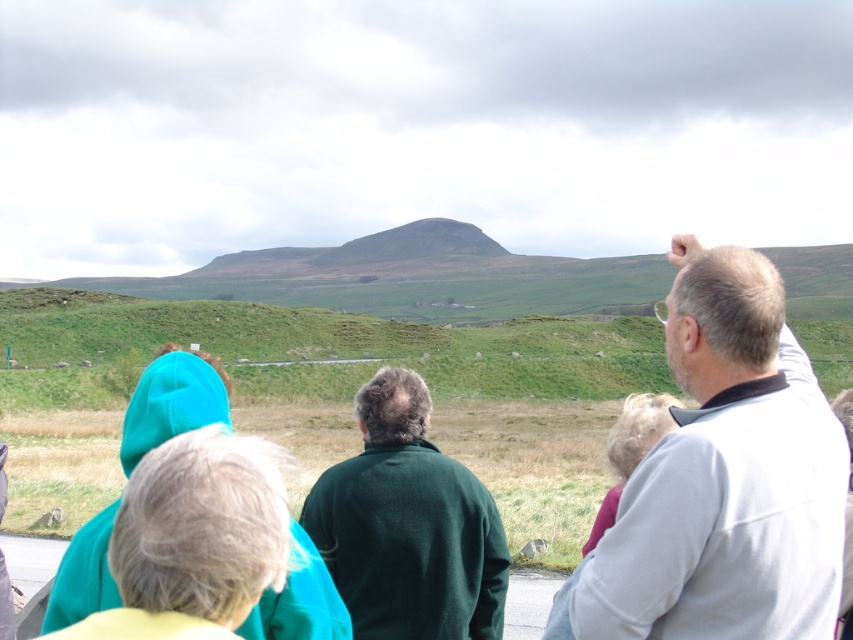
Between gray fleece jacket at upper right and dark green sweater at center, which one has more height?

With more height is gray fleece jacket at upper right.

Does gray fleece jacket at upper right have a lesser width compared to dark green sweater at center?

No, gray fleece jacket at upper right is not thinner than dark green sweater at center.

Locate an element on the screen. The image size is (853, 640). gray fleece jacket at upper right is located at coordinates (726, 476).